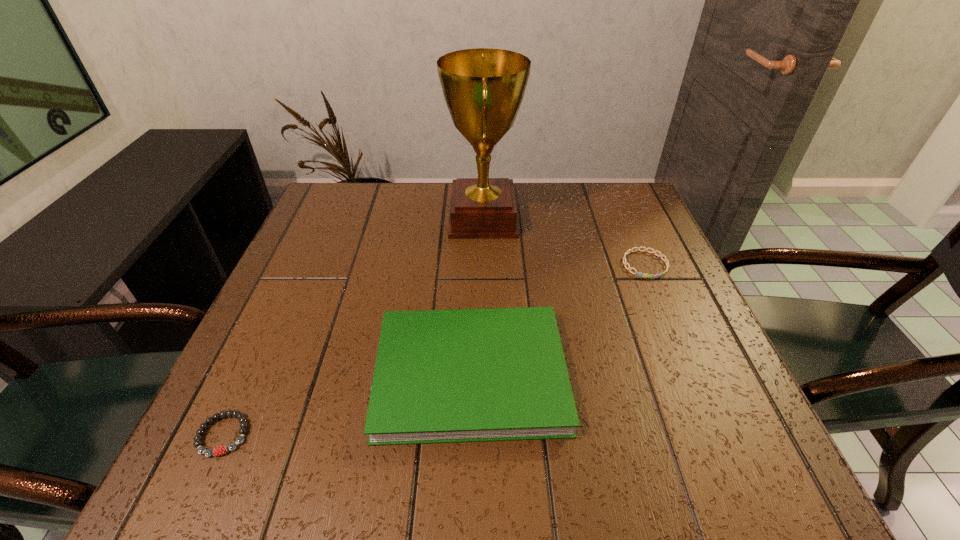
This screenshot has height=540, width=960. I want to click on vacant space located 0.290m on the surface of the farther bracelet showing star-shaped elements, so click(698, 389).

Image resolution: width=960 pixels, height=540 pixels. Find the location of `vacant position located 0.110m on the back of the left bracelet`. vacant position located 0.110m on the back of the left bracelet is located at coordinates (258, 360).

At what (x,y) coordinates should I click in order to perform the action: click on object that is at the far edge. Please return your answer as a coordinate pair (x, y). Looking at the image, I should click on (483, 88).

The image size is (960, 540). What are the coordinates of `paperback book at the near edge` in the screenshot? It's located at (493, 374).

The height and width of the screenshot is (540, 960). I want to click on bracelet that is at the near edge, so click(218, 451).

At what (x,y) coordinates should I click in order to perform the action: click on object present at the left edge. Please return your answer as a coordinate pair (x, y). Looking at the image, I should click on (218, 451).

The height and width of the screenshot is (540, 960). What are the coordinates of `object present at the right edge` in the screenshot? It's located at [x=666, y=261].

You are a GUI agent. You are given a task and a screenshot of the screen. Output one action in this format:
    pyautogui.click(x=<x>, y=<y>)
    Task: Click on the object present at the near left corner
    This screenshot has height=540, width=960.
    Given the screenshot: What is the action you would take?
    pyautogui.click(x=218, y=451)

In the image, there is a desktop. Identify the location of vacant space at the far edge. (402, 190).

In the image, there is a desktop. Where is `vacant space at the near edge`? vacant space at the near edge is located at coordinates (600, 480).